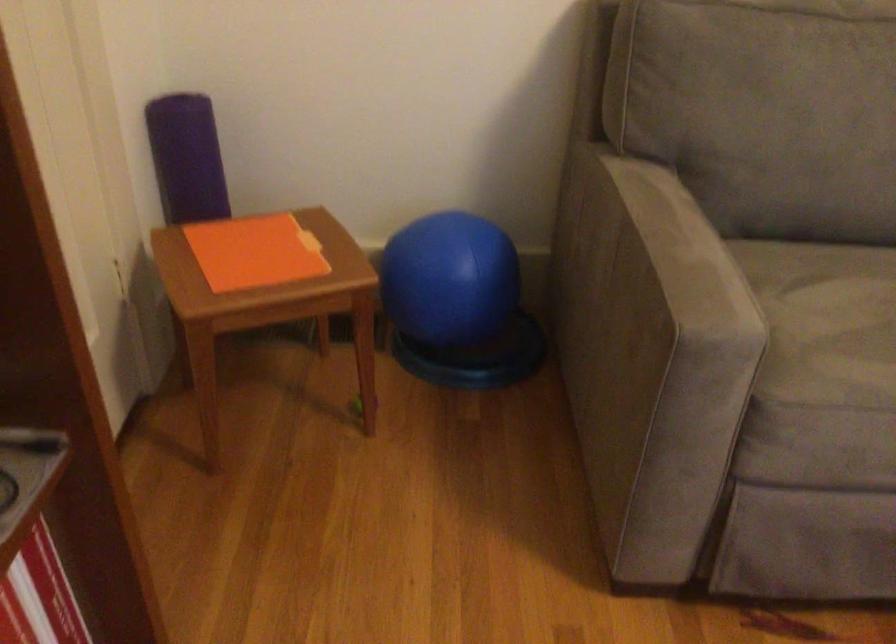
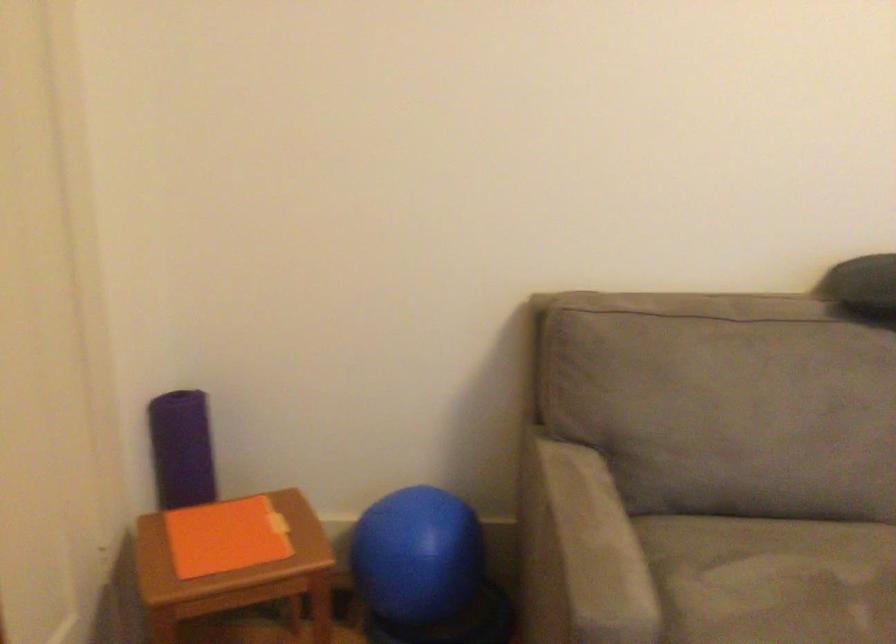
What movement of the cameraman would produce the second image?

The cameraman moved toward right, backward.